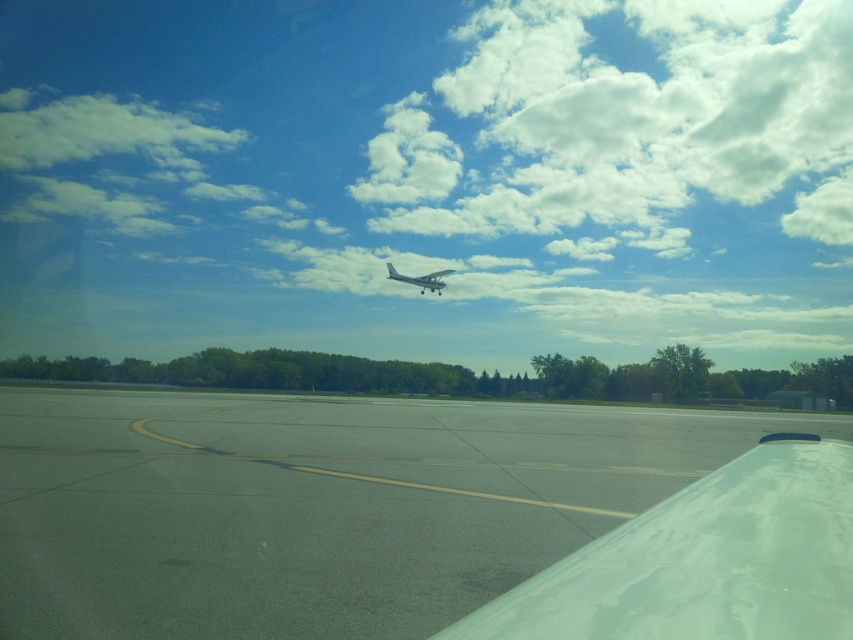
You are a pilot trying to land your plane on the runway. There is a transparent plastic airplane wing at lower right. Can you see the transparent plastic airplane wing at lower right from your current position? The coordinates are given as point (705,561). Please explain why or why not based on the scene description.

The transparent plastic airplane wing at lower right is marked by point (705,561), which is on the runway tarmac. Since the wing is on the runway and the pilot is in another aircraft, the pilot can see the transparent plastic airplane wing at lower right from their current position as it is part of the visible scene.

You are a pilot preparing for takeoff and you notice two landmarks in your view ahead. The white fluffy cloud at upper center and the gray asphalt runway at center. Which one is positioned to the left when looking from your cockpit?

The white fluffy cloud at upper center is positioned to the left of the gray asphalt runway at center.